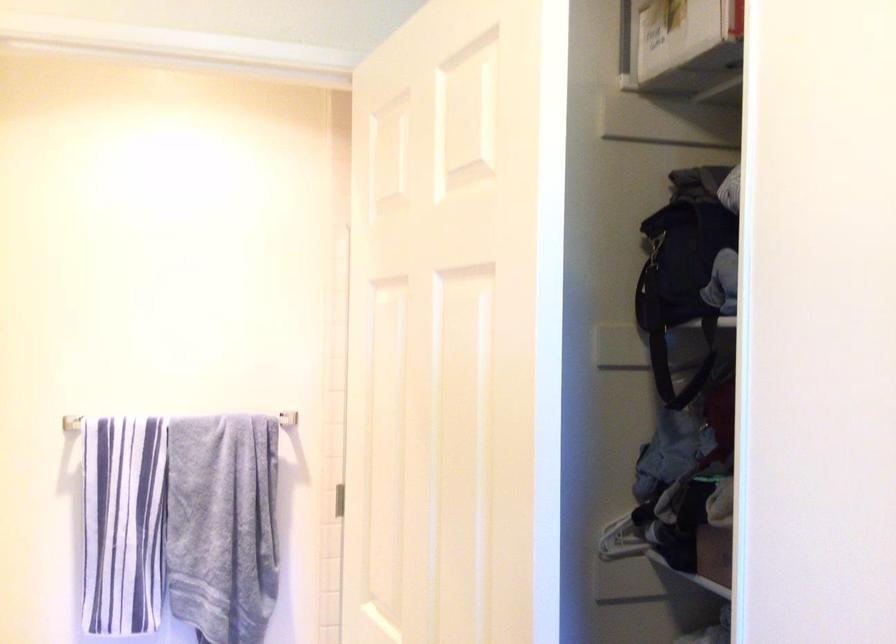
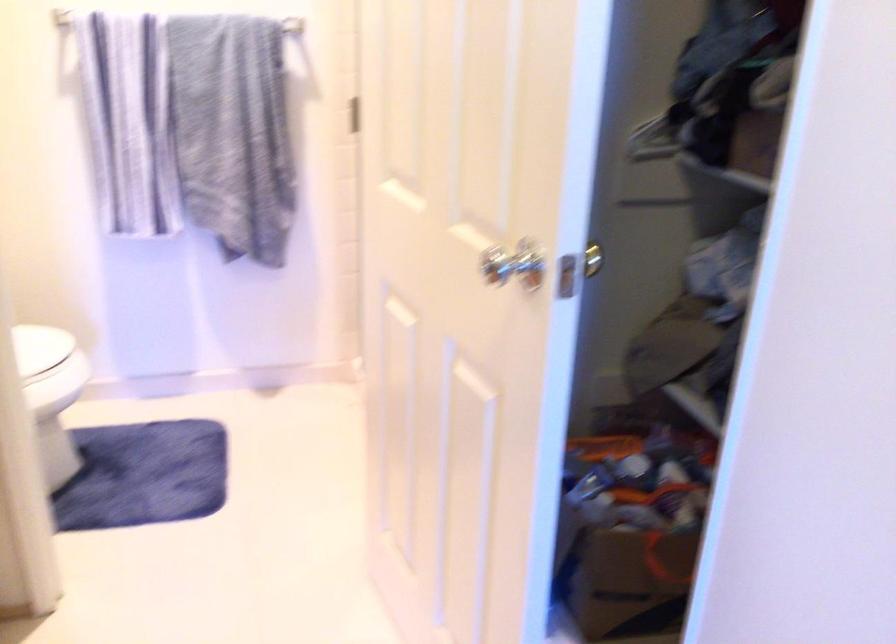
Question: In a continuous first-person perspective shot, in which direction is the camera moving?

Choices:
 (A) Left
 (B) Right
 (C) Forward
 (D) Backward

Answer: (C)